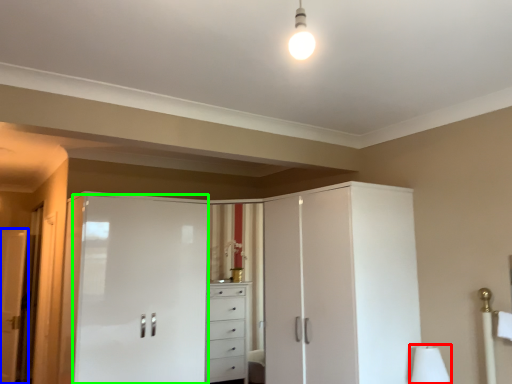
Question: Which is nearer to the table lamp (highlighted by a red box)? door (highlighted by a blue box) or screen door (highlighted by a green box).

Choices:
 (A) door
 (B) screen door

Answer: (B)